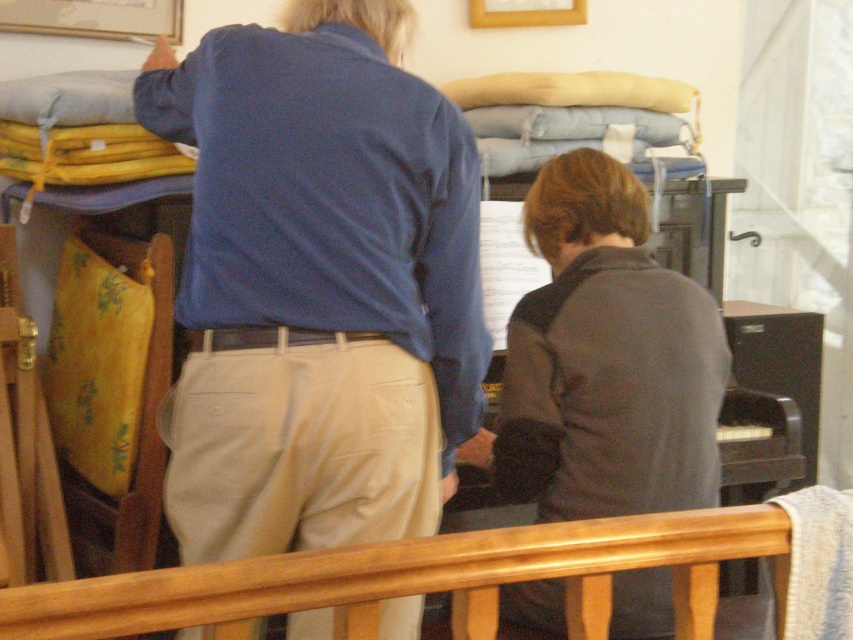
Question: Which point is closer to the camera?

Choices:
 (A) dark gray sweater at center
 (B) wooden rail at lower center
 (C) blue cotton shirt at upper center

Answer: (B)

Question: Which of these objects is positioned closest to the dark gray sweater at center?

Choices:
 (A) blue cotton shirt at upper center
 (B) wooden rail at lower center

Answer: (A)

Question: Can you confirm if dark gray sweater at center is positioned above wooden rail at lower center?

Choices:
 (A) yes
 (B) no

Answer: (A)

Question: Which object appears closest to the camera in this image?

Choices:
 (A) dark gray sweater at center
 (B) wooden rail at lower center

Answer: (B)

Question: Is dark gray sweater at center above wooden rail at lower center?

Choices:
 (A) yes
 (B) no

Answer: (A)

Question: Is blue cotton shirt at upper center positioned before dark gray sweater at center?

Choices:
 (A) no
 (B) yes

Answer: (B)